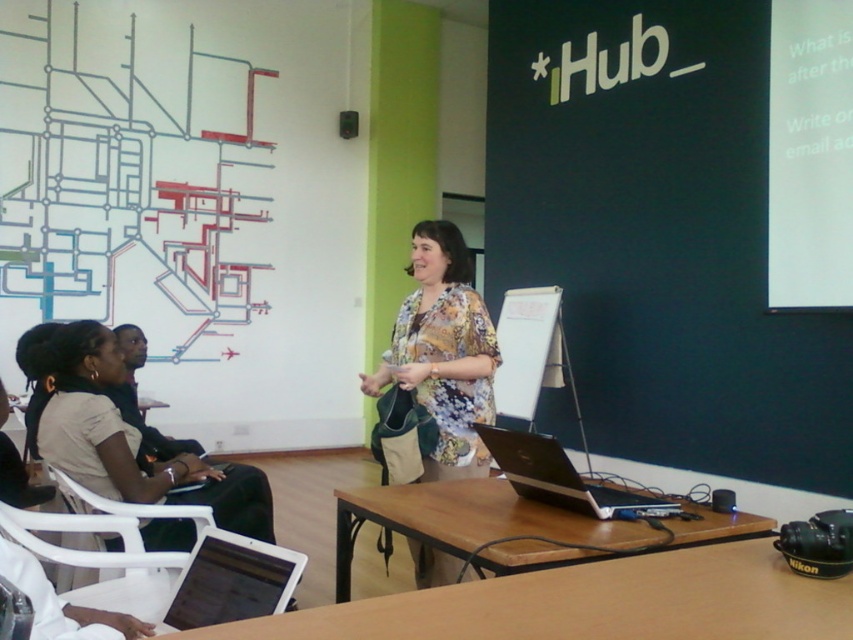
Between silver/black laptop at center and green matte projector at lower right, which one is positioned lower?

silver/black laptop at center is below.

Does point (532, 456) come in front of point (840, 538)?

No, it is behind (840, 538).

Is point (561, 477) farther from viewer compared to point (787, 531)?

Yes, point (561, 477) is behind point (787, 531).

At what (x,y) coordinates should I click in order to perform the action: click on silver/black laptop at center. Please return your answer as a coordinate pair (x, y). Image resolution: width=853 pixels, height=640 pixels. Looking at the image, I should click on (561, 477).

Does floral fabric shirt at center have a larger size compared to white plastic chair at lower left?

Yes.

Which is above, floral fabric shirt at center or white plastic chair at lower left?

floral fabric shirt at center

This screenshot has width=853, height=640. Describe the element at coordinates (444, 352) in the screenshot. I see `floral fabric shirt at center` at that location.

Find the location of a particular element. floral fabric shirt at center is located at coordinates (444, 352).

Measure the distance between light beige fabric shirt at lower left and camera.

The distance of light beige fabric shirt at lower left from camera is 8.17 feet.

Which is behind, point (247, 518) or point (212, 618)?

The point (247, 518) is behind.

Where is `light beige fabric shirt at lower left`? light beige fabric shirt at lower left is located at coordinates (126, 436).